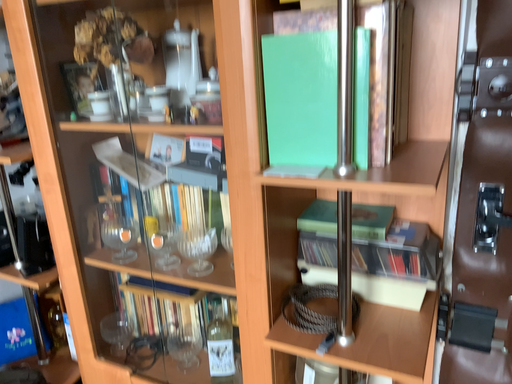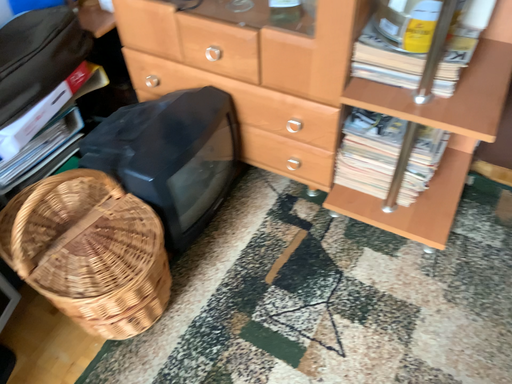
Question: Which way did the camera rotate in the video?

Choices:
 (A) rotated upward
 (B) rotated downward

Answer: (B)